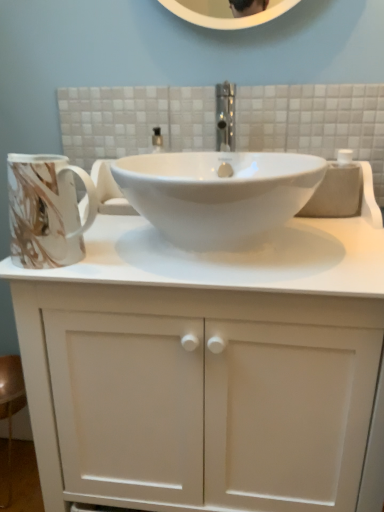
Question: From the image's perspective, is marbled ceramic mug at left beneath white matte cabinet at center?

Choices:
 (A) no
 (B) yes

Answer: (A)

Question: Is marbled ceramic mug at left smaller than white matte cabinet at center?

Choices:
 (A) no
 (B) yes

Answer: (B)

Question: Considering the relative positions of marbled ceramic mug at left and white matte cabinet at center in the image provided, is marbled ceramic mug at left in front of white matte cabinet at center?

Choices:
 (A) no
 (B) yes

Answer: (A)

Question: Is marbled ceramic mug at left to the right of white matte cabinet at center from the viewer's perspective?

Choices:
 (A) no
 (B) yes

Answer: (A)

Question: Is marbled ceramic mug at left looking in the opposite direction of white matte cabinet at center?

Choices:
 (A) yes
 (B) no

Answer: (A)

Question: Is marbled ceramic mug at left behind white matte cabinet at center?

Choices:
 (A) no
 (B) yes

Answer: (B)

Question: Does white glossy sink at center have a greater height compared to white matte cabinet at center?

Choices:
 (A) yes
 (B) no

Answer: (B)

Question: Does white glossy sink at center have a lesser width compared to white matte cabinet at center?

Choices:
 (A) no
 (B) yes

Answer: (B)

Question: Is white glossy sink at center turned away from white matte cabinet at center?

Choices:
 (A) yes
 (B) no

Answer: (A)

Question: Considering the relative positions of white glossy sink at center and white matte cabinet at center in the image provided, is white glossy sink at center to the right of white matte cabinet at center from the viewer's perspective?

Choices:
 (A) yes
 (B) no

Answer: (B)

Question: From a real-world perspective, is white glossy sink at center physically below white matte cabinet at center?

Choices:
 (A) no
 (B) yes

Answer: (A)

Question: Does white glossy sink at center turn towards white matte cabinet at center?

Choices:
 (A) no
 (B) yes

Answer: (B)

Question: Is white glossy sink at center surrounding marbled ceramic mug at left?

Choices:
 (A) yes
 (B) no

Answer: (B)